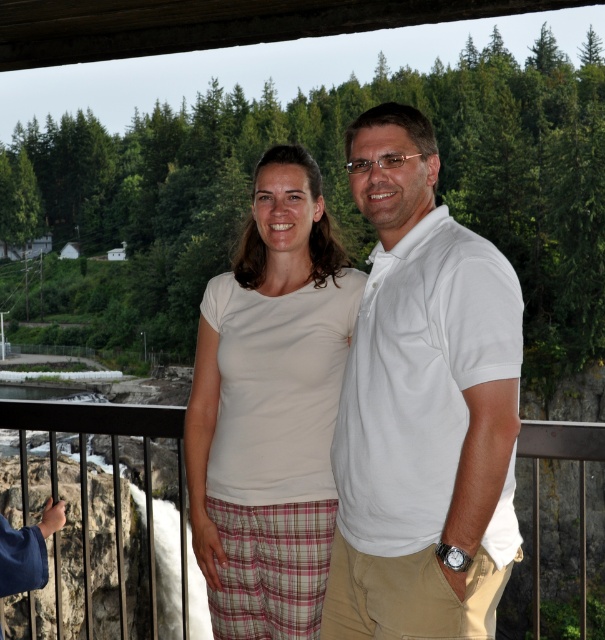
Who is shorter, white cotton shirt at center or black metal railing at center?

white cotton shirt at center is shorter.

This screenshot has width=605, height=640. Find the location of `white cotton shirt at center`. white cotton shirt at center is located at coordinates (269, 408).

How much distance is there between white cotton polo shirt at center and white cotton shirt at center?

3.50 meters

Is point (427, 440) positioned in front of point (330, 483)?

Yes, point (427, 440) is closer to viewer.

Describe the element at coordinates (422, 406) in the screenshot. I see `white cotton polo shirt at center` at that location.

Locate an element on the screen. This screenshot has height=640, width=605. white cotton polo shirt at center is located at coordinates (422, 406).

Can you confirm if white cotton polo shirt at center is taller than black metal railing at center?

Incorrect, white cotton polo shirt at center's height is not larger of black metal railing at center's.

Does white cotton polo shirt at center have a lesser width compared to black metal railing at center?

Yes, white cotton polo shirt at center is thinner than black metal railing at center.

You are a GUI agent. You are given a task and a screenshot of the screen. Output one action in this format:
    pyautogui.click(x=<x>, y=<y>)
    Task: Click on the white cotton polo shirt at center
    The height and width of the screenshot is (640, 605).
    Given the screenshot: What is the action you would take?
    pyautogui.click(x=422, y=406)